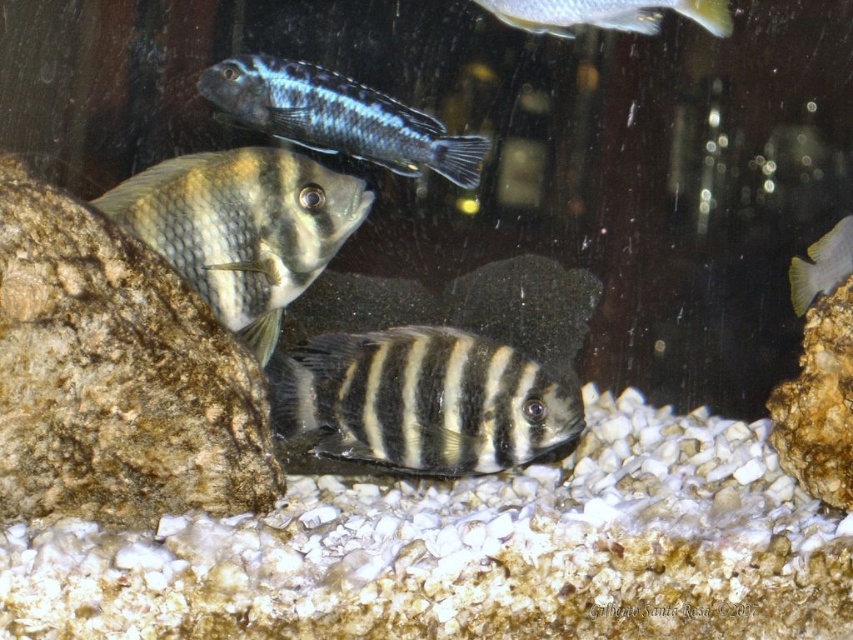
Looking at the aquarium scene, there are two fish visible in the water. The black striped fish at center and the shiny silver fish at upper center. Which one is positioned to the left of the other?

The black striped fish at center is to the left of the shiny silver fish at upper center.

You are a marine biologist observing the aquarium. You need to capture a closeup photo of the striped matte fish at center. Your camera can focus on objects within 4 feet. Can you take the photo without moving closer?

The striped matte fish at center is 5.02 feet away from the camera. Since your camera can only focus within 4 feet, you cannot take the closeup photo without moving closer.